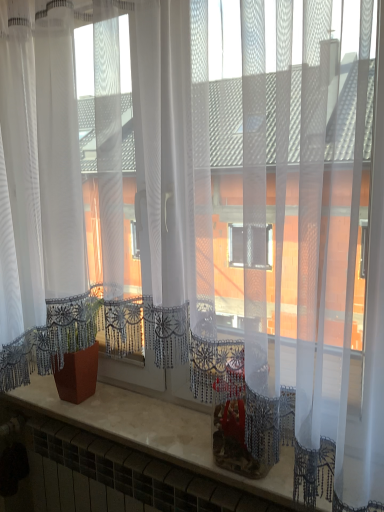
The image size is (384, 512). Identify the location of free location in front of matte terracotta pot at lower left. (85, 415).